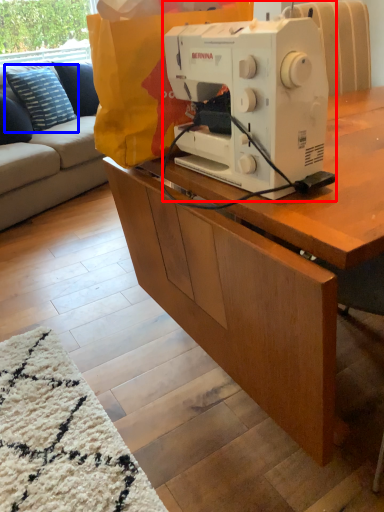
Question: Which of the following is the farthest to the observer, sewing machine (highlighted by a red box) or pillow (highlighted by a blue box)?

Choices:
 (A) sewing machine
 (B) pillow

Answer: (B)